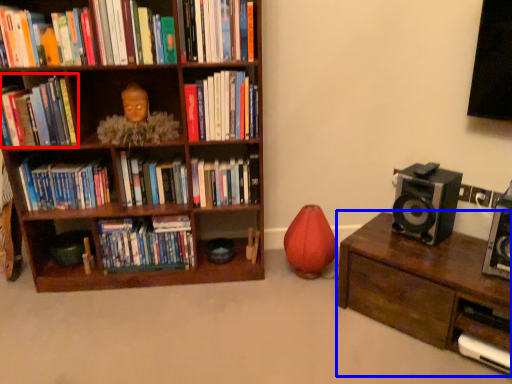
Question: Among these objects, which one is nearest to the camera, book (highlighted by a red box) or table (highlighted by a blue box)?

Choices:
 (A) book
 (B) table

Answer: (B)